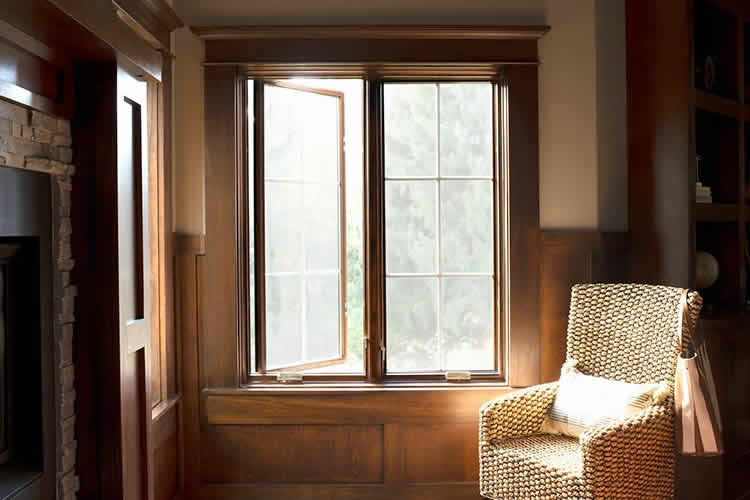
This screenshot has width=750, height=500. Identify the location of seat of chair. (561, 450).